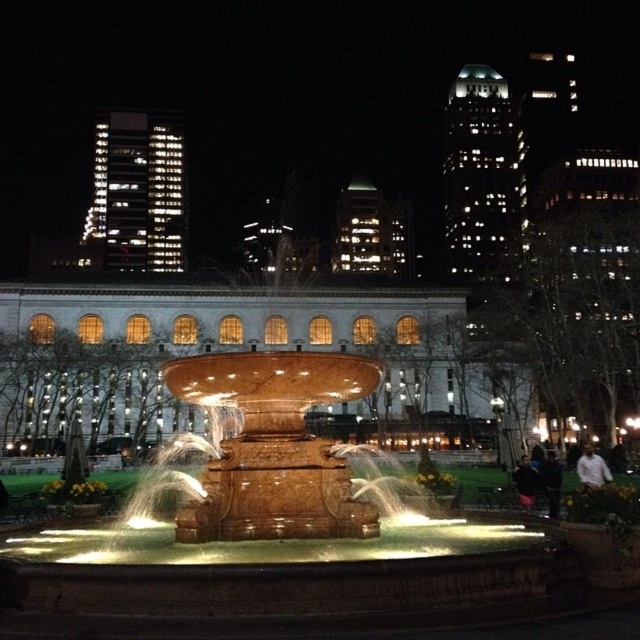
Is point (541, 474) closer to viewer compared to point (532, 468)?

That is True.

Describe the element at coordinates (550, 481) in the screenshot. I see `dark blue jeans at lower right` at that location.

What do you see at coordinates (550, 481) in the screenshot?
I see `dark blue jeans at lower right` at bounding box center [550, 481].

You are a GUI agent. You are given a task and a screenshot of the screen. Output one action in this format:
    pyautogui.click(x=<x>, y=<y>)
    Task: Click on the dark blue jeans at lower right
    This screenshot has width=640, height=640.
    Given the screenshot: What is the action you would take?
    pyautogui.click(x=550, y=481)

How much distance is there between white cotton shirt at lower right and dark blue fabric jacket at lower right?

6.18 meters

Is point (586, 472) positioned behind point (513, 477)?

No, (586, 472) is closer to viewer.

This screenshot has height=640, width=640. In order to click on white cotton shirt at lower right in this screenshot , I will do click(x=593, y=468).

How distant is dark blue jeans at lower right from white cotton shirt at lower right?

A distance of 10.12 feet exists between dark blue jeans at lower right and white cotton shirt at lower right.

Can you confirm if dark blue jeans at lower right is thinner than white cotton shirt at lower right?

Correct, dark blue jeans at lower right's width is less than white cotton shirt at lower right's.

Which is in front, point (554, 492) or point (588, 444)?

Positioned in front is point (554, 492).

Where is `dark blue jeans at lower right`? dark blue jeans at lower right is located at coordinates (550, 481).